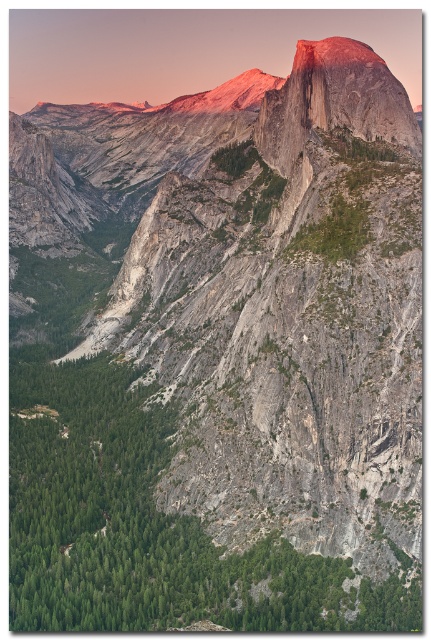
Which is above, green rough rock at center or matte granite peak at center?

matte granite peak at center is above.

Describe the element at coordinates (147, 525) in the screenshot. I see `green rough rock at center` at that location.

What are the coordinates of `green rough rock at center` in the screenshot? It's located at (147, 525).